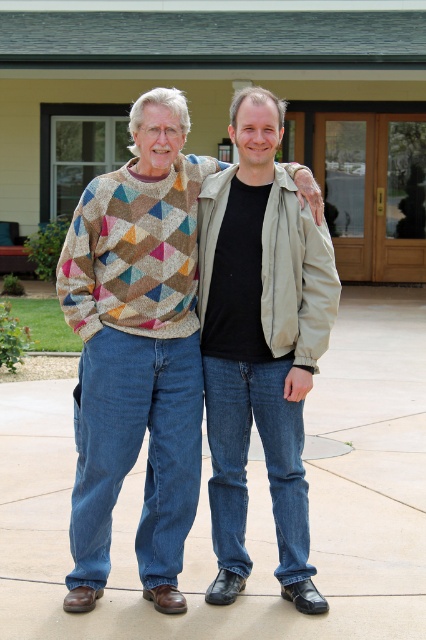
You are a fashion designer observing two people in the scene. You need to determine which clothing item, the multicolored knitted sweater at center or the matte beige jacket at center, would require more fabric to produce. Based on the visual information provided, which one would you choose?

The multicolored knitted sweater at center has a larger width than the matte beige jacket at center, so it would require more fabric to produce.

You are a fashion designer observing two people in the scene. You need to determine which clothing item is more to the left. The items are the multicolored knitted sweater at center and the matte beige jacket at center. Which one is positioned further to the left?

The multicolored knitted sweater at center is positioned on the left side of matte beige jacket at center, so it is more to the left.